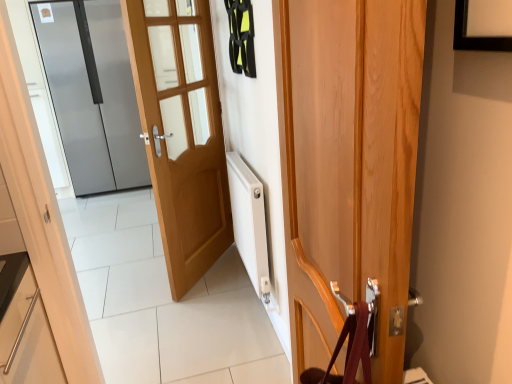
Where is `light brown wood door at center, which ranks as the 2th door in left-to-right order`? light brown wood door at center, which ranks as the 2th door in left-to-right order is located at coordinates (181, 132).

Between light brown wood door at center, the 2th door viewed from the right, and wooden door at center, the 1th door in the front-to-back sequence, which one has larger width?

wooden door at center, the 1th door in the front-to-back sequence.

From the picture: What's the angular difference between light brown wood door at center, positioned as the 2th door in back-to-front order, and wooden door at center, the 3th door viewed from the left,'s facing directions?

The facing directions of light brown wood door at center, positioned as the 2th door in back-to-front order, and wooden door at center, the 3th door viewed from the left, are 36.4 degrees apart.

Does light brown wood door at center, the 2th door viewed from the right, appear on the right side of wooden door at center, the 3th door viewed from the left?

No, light brown wood door at center, the 2th door viewed from the right, is not to the right of wooden door at center, the 3th door viewed from the left.

From a real-world perspective, is light brown wood door at center, the 2th door viewed from the right, under wooden door at center, acting as the first door starting from the right?

Actually, light brown wood door at center, the 2th door viewed from the right, is physically above wooden door at center, acting as the first door starting from the right, in the real world.

From the satin silver refrigerator at left, which is the first door from left to right, count 1st door to the right and point to it. Please provide its 2D coordinates.

[(181, 132)]

Is satin silver refrigerator at left, the 1th door in the back-to-front sequence, oriented towards light brown wood door at center, which ranks as the 2th door in left-to-right order?

Yes.

Considering the sizes of satin silver refrigerator at left, which is the first door from left to right, and light brown wood door at center, which ranks as the 2th door in left-to-right order, in the image, is satin silver refrigerator at left, which is the first door from left to right, wider or thinner than light brown wood door at center, which ranks as the 2th door in left-to-right order,?

satin silver refrigerator at left, which is the first door from left to right, is wider than light brown wood door at center, which ranks as the 2th door in left-to-right order.

Does wooden door at center, acting as the first door starting from the right, turn towards light brown wood door at center, which is counted as the 2th door, starting from the front?

No.

Can you confirm if wooden door at center, the 3th door viewed from the left, is thinner than light brown wood door at center, positioned as the 2th door in back-to-front order?

Incorrect, the width of wooden door at center, the 3th door viewed from the left, is not less than that of light brown wood door at center, positioned as the 2th door in back-to-front order.

Between point (346, 61) and point (180, 200), which one is positioned in front?

The point (346, 61) is closer.

In the scene shown: Is wooden door at center, the 3th door viewed from the left, situated inside light brown wood door at center, which is counted as the 2th door, starting from the front, or outside?

wooden door at center, the 3th door viewed from the left, is not enclosed by light brown wood door at center, which is counted as the 2th door, starting from the front.

Does satin silver refrigerator at left, the 1th door in the back-to-front sequence, turn towards wooden door at center, acting as the first door starting from the right?

Yes, satin silver refrigerator at left, the 1th door in the back-to-front sequence, faces towards wooden door at center, acting as the first door starting from the right.

Does point (99, 139) come behind point (411, 43)?

Yes, point (99, 139) is farther from viewer.

Does satin silver refrigerator at left, the 1th door in the back-to-front sequence, appear on the left side of wooden door at center, which is counted as the third door, starting from the back?

Indeed, satin silver refrigerator at left, the 1th door in the back-to-front sequence, is positioned on the left side of wooden door at center, which is counted as the third door, starting from the back.

From a real-world perspective, between wooden door at center, the 3th door viewed from the left, and satin silver refrigerator at left, which is the first door from left to right, who is vertically lower?

wooden door at center, the 3th door viewed from the left, from a real-world perspective.

Considering the positions of objects wooden door at center, the 1th door in the front-to-back sequence, and satin silver refrigerator at left, the 1th door in the back-to-front sequence, in the image provided, who is more to the right, wooden door at center, the 1th door in the front-to-back sequence, or satin silver refrigerator at left, the 1th door in the back-to-front sequence,?

wooden door at center, the 1th door in the front-to-back sequence, is more to the right.

Is wooden door at center, acting as the first door starting from the right, looking in the opposite direction of satin silver refrigerator at left, acting as the 3th door starting from the front?

No, wooden door at center, acting as the first door starting from the right,'s orientation is not away from satin silver refrigerator at left, acting as the 3th door starting from the front.

From the image's perspective, is wooden door at center, which is counted as the third door, starting from the back, beneath satin silver refrigerator at left, which is the first door from left to right?

Indeed, from the image's perspective, wooden door at center, which is counted as the third door, starting from the back, is shown beneath satin silver refrigerator at left, which is the first door from left to right.

Considering the relative sizes of light brown wood door at center, which is counted as the 2th door, starting from the front, and satin silver refrigerator at left, acting as the 3th door starting from the front, in the image provided, is light brown wood door at center, which is counted as the 2th door, starting from the front, wider than satin silver refrigerator at left, acting as the 3th door starting from the front,?

No, light brown wood door at center, which is counted as the 2th door, starting from the front, is not wider than satin silver refrigerator at left, acting as the 3th door starting from the front.

Is light brown wood door at center, which ranks as the 2th door in left-to-right order, bigger than satin silver refrigerator at left, acting as the 3th door starting from the front?

Actually, light brown wood door at center, which ranks as the 2th door in left-to-right order, might be smaller than satin silver refrigerator at left, acting as the 3th door starting from the front.

From the image's perspective, would you say light brown wood door at center, positioned as the 2th door in back-to-front order, is positioned over satin silver refrigerator at left, the 1th door in the back-to-front sequence?

No, from the image's perspective, light brown wood door at center, positioned as the 2th door in back-to-front order, is not on top of satin silver refrigerator at left, the 1th door in the back-to-front sequence.

In order to click on door that is the 1st one above the wooden door at center, acting as the first door starting from the right (from a real-world perspective) in this screenshot , I will do `click(181, 132)`.

Where is `door on the left of light brown wood door at center, which ranks as the 2th door in left-to-right order`? door on the left of light brown wood door at center, which ranks as the 2th door in left-to-right order is located at coordinates (92, 93).

Estimate the real-world distances between objects in this image. Which object is closer to satin silver refrigerator at left, the third door from the right, wooden door at center, acting as the first door starting from the right, or light brown wood door at center, the 2th door viewed from the right?

light brown wood door at center, the 2th door viewed from the right, is closer to satin silver refrigerator at left, the third door from the right.

From the picture: Which object lies further to the anchor point wooden door at center, the 1th door in the front-to-back sequence, satin silver refrigerator at left, the third door from the right, or light brown wood door at center, the 2th door viewed from the right?

The object further to wooden door at center, the 1th door in the front-to-back sequence, is satin silver refrigerator at left, the third door from the right.

Considering their positions, is satin silver refrigerator at left, acting as the 3th door starting from the front, positioned further to light brown wood door at center, which ranks as the 2th door in left-to-right order, than wooden door at center, which is counted as the third door, starting from the back?

Among the two, satin silver refrigerator at left, acting as the 3th door starting from the front, is located further to light brown wood door at center, which ranks as the 2th door in left-to-right order.

Which object lies further to the anchor point wooden door at center, acting as the first door starting from the right, light brown wood door at center, which is counted as the 2th door, starting from the front, or satin silver refrigerator at left, acting as the 3th door starting from the front?

satin silver refrigerator at left, acting as the 3th door starting from the front, is positioned further to the anchor wooden door at center, acting as the first door starting from the right.

From the image, which object appears to be nearer to light brown wood door at center, the 2th door viewed from the right, wooden door at center, the 1th door in the front-to-back sequence, or satin silver refrigerator at left, the 1th door in the back-to-front sequence?

wooden door at center, the 1th door in the front-to-back sequence.

From the image, which object appears to be farther from satin silver refrigerator at left, the third door from the right, light brown wood door at center, which ranks as the 2th door in left-to-right order, or wooden door at center, acting as the first door starting from the right?

wooden door at center, acting as the first door starting from the right, is positioned further to the anchor satin silver refrigerator at left, the third door from the right.

Find the location of a particular element. door between wooden door at center, which is counted as the third door, starting from the back, and satin silver refrigerator at left, the 1th door in the back-to-front sequence, from front to back is located at coordinates pos(181,132).